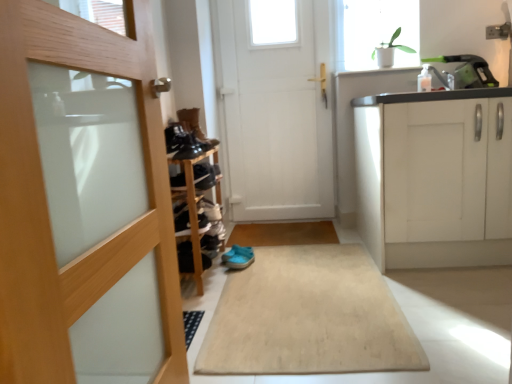
Question: Would you say black suede shoe at center, marked as the 1th shoe in a front-to-back arrangement, is inside or outside white matte door at center, the second door in the left-to-right sequence?

Choices:
 (A) outside
 (B) inside

Answer: (A)

Question: In the image, is black suede shoe at center, acting as the fourth shoe starting from the top, on the left side or the right side of white matte door at center, the second door in the left-to-right sequence?

Choices:
 (A) right
 (B) left

Answer: (B)

Question: Considering the real-world distances, which object is closest to the shiny black shoe at center, marked as the third shoe in a top-to-bottom arrangement?

Choices:
 (A) white glossy plant at upper right
 (B) black suede shoe at lower left, arranged as the 3th shoe when viewed from the back
 (C) leather boots at center, which is the 1th shoe from top to bottom
 (D) white matte door at center, the second door in the left-to-right sequence
 (E) white glossy sink at upper right

Answer: (C)

Question: Which object is the farthest from the beige carpet at center?

Choices:
 (A) white glossy sink at upper right
 (B) leather boots at center, which is counted as the 5th shoe, starting from the bottom
 (C) white matte door at center, the second door in the left-to-right sequence
 (D) black suede shoe at center, which ranks as the fifth shoe in back-to-front order
 (E) wooden door at left, acting as the 1th door starting from the left

Answer: (C)